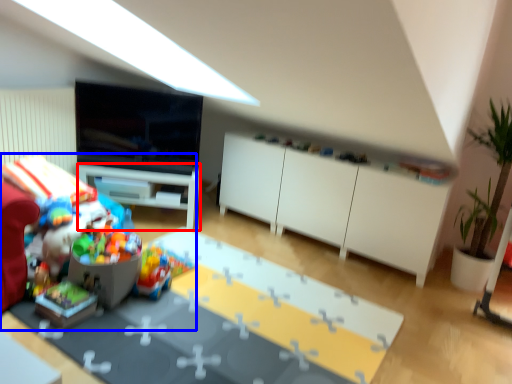
Question: Which of the following is the closest to the observer, desk (highlighted by a red box) or toy (highlighted by a blue box)?

Choices:
 (A) desk
 (B) toy

Answer: (B)